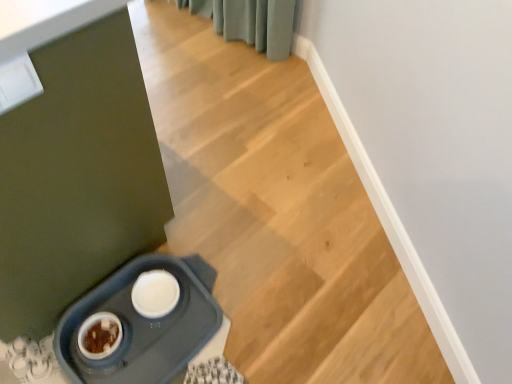
Locate an element on the screen. Image resolution: width=512 pixels, height=384 pixels. free space to the right of matte plastic pet feeder at lower left is located at coordinates (276, 311).